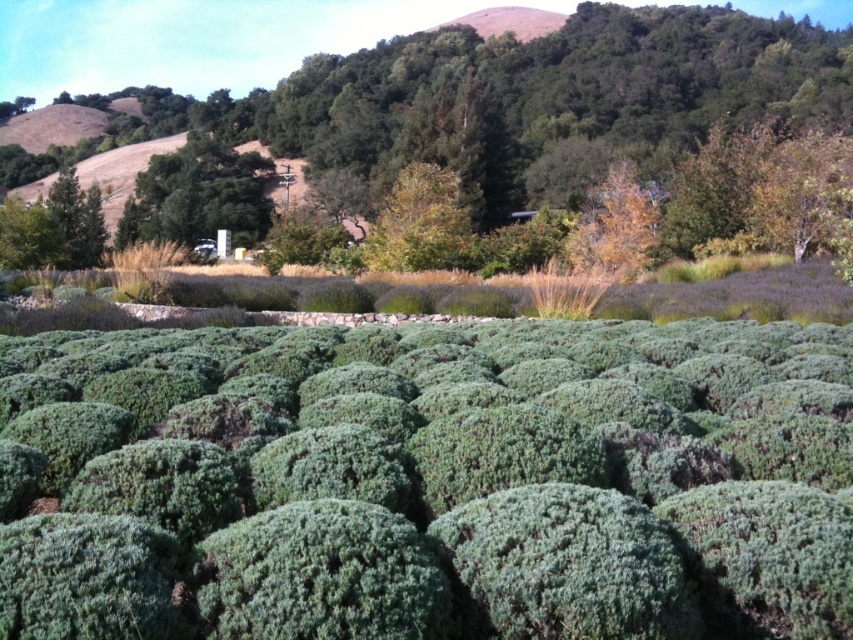
Question: Which object appears farthest from the camera in this image?

Choices:
 (A) green leafy tree at center
 (B) green leafy tree at upper center

Answer: (B)

Question: Does green leafy tree at center have a smaller size compared to green leafy tree at upper center?

Choices:
 (A) yes
 (B) no

Answer: (B)

Question: Is green leafy tree at center further to the viewer compared to green leafy tree at upper center?

Choices:
 (A) no
 (B) yes

Answer: (A)

Question: Which object appears farthest from the camera in this image?

Choices:
 (A) green leafy tree at center
 (B) green leafy tree at upper center

Answer: (B)

Question: Can you confirm if green leafy tree at center is positioned above green leafy tree at upper center?

Choices:
 (A) no
 (B) yes

Answer: (B)